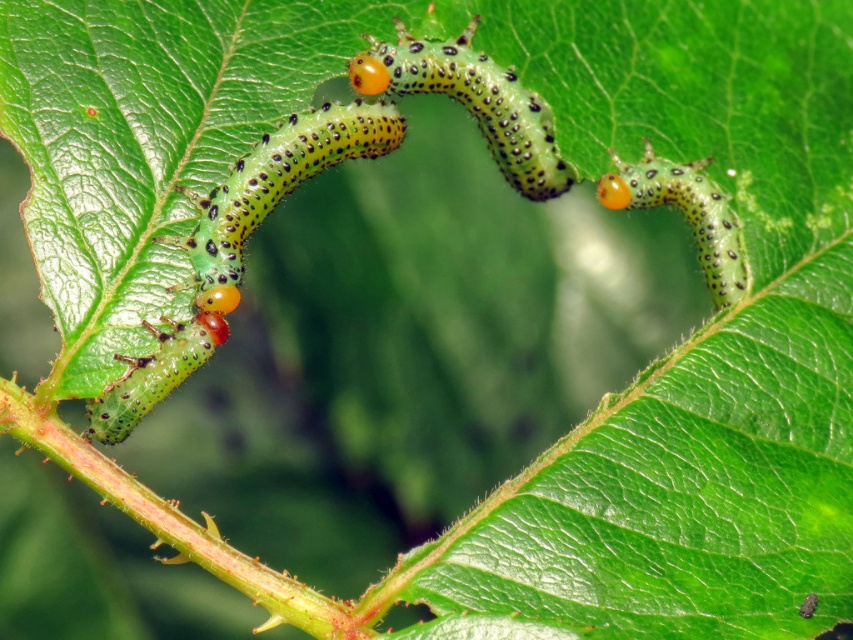
Question: Is green spotted caterpillar at center positioned behind green speckled caterpillar at upper right?

Choices:
 (A) no
 (B) yes

Answer: (A)

Question: Does green matte caterpillar at left appear on the left side of green speckled caterpillar at upper right?

Choices:
 (A) yes
 (B) no

Answer: (A)

Question: Which is nearer to the green matte caterpillar at left?

Choices:
 (A) green spotted caterpillar at center
 (B) green speckled caterpillar at upper right

Answer: (A)

Question: Which object is the farthest from the green spotted caterpillar at center?

Choices:
 (A) green speckled caterpillar at upper right
 (B) green matte caterpillar at left

Answer: (A)

Question: Can you confirm if green matte caterpillar at left is wider than green spotted caterpillar at center?

Choices:
 (A) yes
 (B) no

Answer: (A)

Question: Among these points, which one is nearest to the camera?

Choices:
 (A) (650, 180)
 (B) (550, 154)
 (C) (354, 113)

Answer: (C)